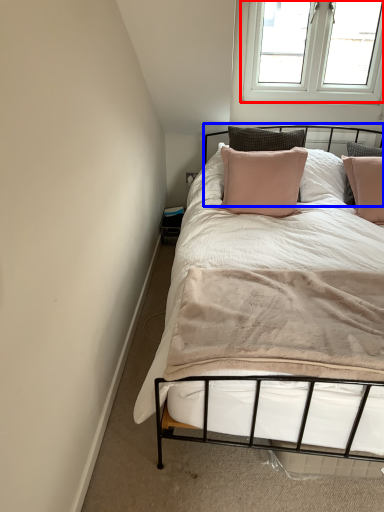
Question: Which of the following is the closest to the observer, window (highlighted by a red box) or headboard (highlighted by a blue box)?

Choices:
 (A) window
 (B) headboard

Answer: (B)